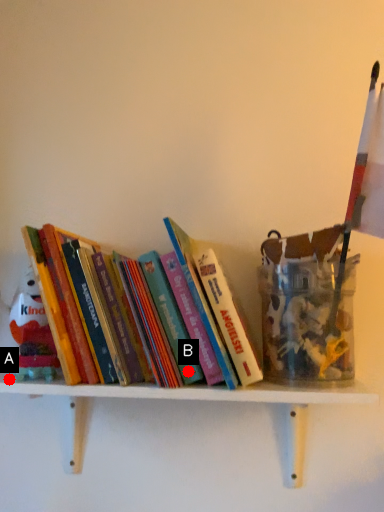
Question: Two points are circled on the image, labeled by A and B beside each circle. Among these points, which one is farthest from the camera?

Choices:
 (A) A is further
 (B) B is further

Answer: (A)